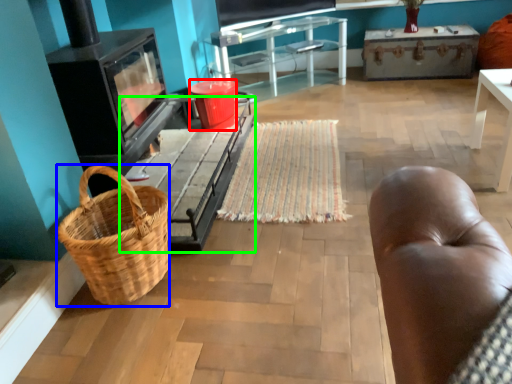
Question: Which is farther away from bucket (highlighted by a red box)? picnic basket (highlighted by a blue box) or table (highlighted by a green box)?

Choices:
 (A) picnic basket
 (B) table

Answer: (A)